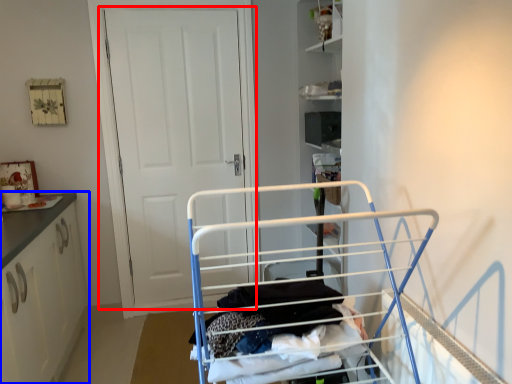
Question: Which object appears farthest to the camera in this image, door (highlighted by a red box) or cabinetry (highlighted by a blue box)?

Choices:
 (A) door
 (B) cabinetry

Answer: (A)